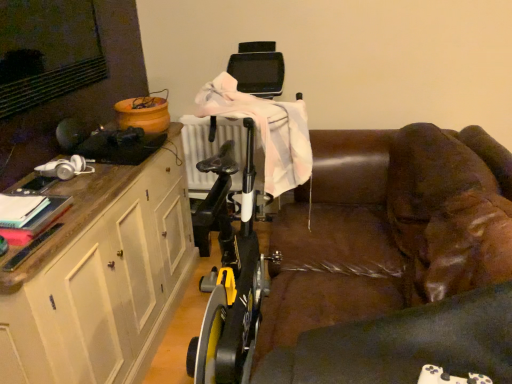
Question: From the image's perspective, is white wood cabinet at left under brown leather couch at center?

Choices:
 (A) yes
 (B) no

Answer: (A)

Question: Is white wood cabinet at left facing towards brown leather couch at center?

Choices:
 (A) yes
 (B) no

Answer: (A)

Question: Does white wood cabinet at left have a larger size compared to brown leather couch at center?

Choices:
 (A) yes
 (B) no

Answer: (B)

Question: Is white wood cabinet at left beside brown leather couch at center?

Choices:
 (A) yes
 (B) no

Answer: (B)

Question: From a real-world perspective, is white wood cabinet at left located beneath brown leather couch at center?

Choices:
 (A) no
 (B) yes

Answer: (A)

Question: Does white wood cabinet at left appear on the right side of brown leather couch at center?

Choices:
 (A) no
 (B) yes

Answer: (A)

Question: Is brown leather couch at center to the left of white wood cabinet at left from the viewer's perspective?

Choices:
 (A) yes
 (B) no

Answer: (B)

Question: Is brown leather couch at center shorter than white wood cabinet at left?

Choices:
 (A) yes
 (B) no

Answer: (A)

Question: From the image's perspective, is brown leather couch at center on top of white wood cabinet at left?

Choices:
 (A) no
 (B) yes

Answer: (B)

Question: Is brown leather couch at center located outside white wood cabinet at left?

Choices:
 (A) yes
 (B) no

Answer: (A)

Question: Does brown leather couch at center have a smaller size compared to white wood cabinet at left?

Choices:
 (A) yes
 (B) no

Answer: (B)

Question: From the image's perspective, does brown leather couch at center appear lower than white wood cabinet at left?

Choices:
 (A) yes
 (B) no

Answer: (B)

Question: In the image, is brown leather couch at center positioned in front of or behind white wood cabinet at left?

Choices:
 (A) front
 (B) behind

Answer: (A)